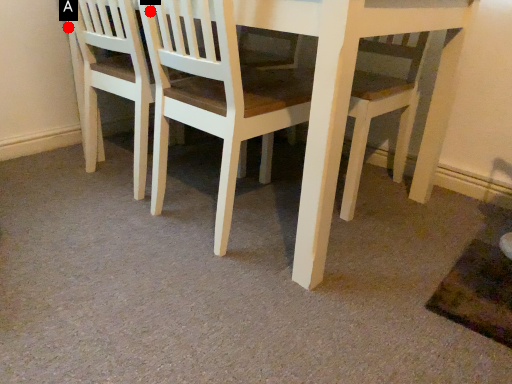
Question: Two points are circled on the image, labeled by A and B beside each circle. Which point is further to the camera?

Choices:
 (A) A is further
 (B) B is further

Answer: (A)